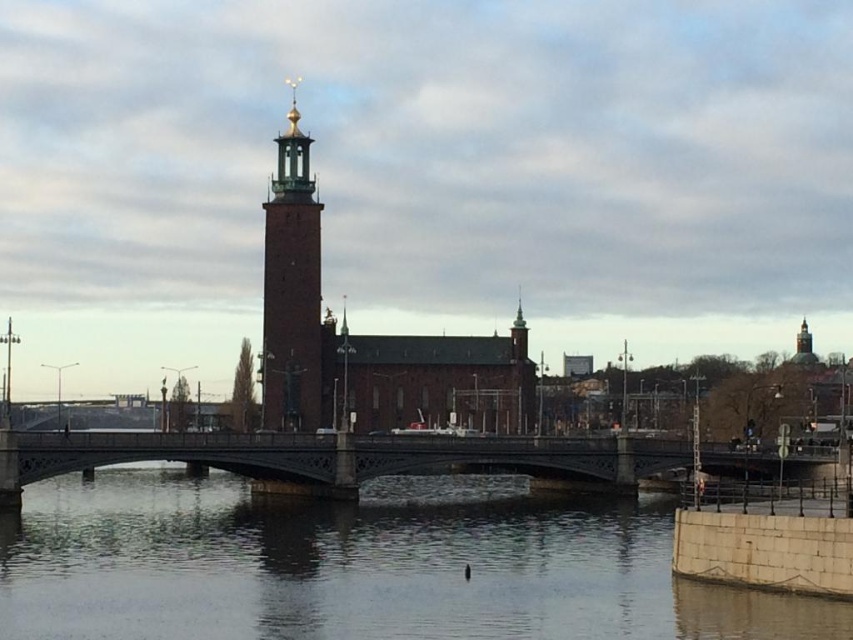
This screenshot has height=640, width=853. What do you see at coordinates (363, 564) in the screenshot?
I see `clear water at bridge center` at bounding box center [363, 564].

Who is more forward, (181, 618) or (329, 444)?

Point (181, 618) is more forward.

This screenshot has width=853, height=640. What do you see at coordinates (363, 564) in the screenshot?
I see `clear water at bridge center` at bounding box center [363, 564].

Locate an element on the screen. This screenshot has width=853, height=640. clear water at bridge center is located at coordinates (363, 564).

What do you see at coordinates (363, 564) in the screenshot? I see `clear water at bridge center` at bounding box center [363, 564].

Which is in front, point (10, 604) or point (318, 221)?

Point (10, 604)

This screenshot has width=853, height=640. Find the location of `clear water at bridge center`. clear water at bridge center is located at coordinates (363, 564).

Does dark gray stone bridge at center appear over brick tower at center?

No.

Is point (315, 481) in front of point (294, 339)?

Yes, point (315, 481) is closer to viewer.

Based on the photo, who is more forward, (329, 468) or (318, 342)?

Point (329, 468)

Find the location of a particular element. Image resolution: width=853 pixels, height=640 pixels. dark gray stone bridge at center is located at coordinates coord(380,458).